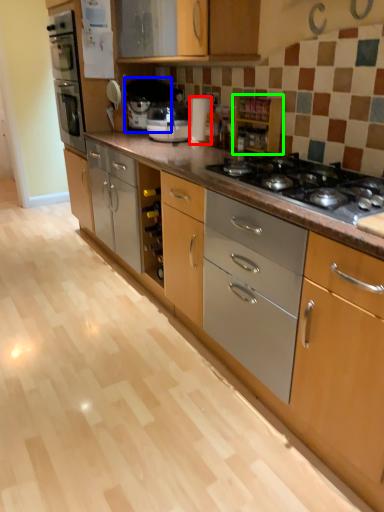
Question: Which object is the farthest from appliance (highlighted by a red box)? Choose among these: coffee machine (highlighted by a blue box) or cabinetry (highlighted by a green box).

Choices:
 (A) coffee machine
 (B) cabinetry

Answer: (A)